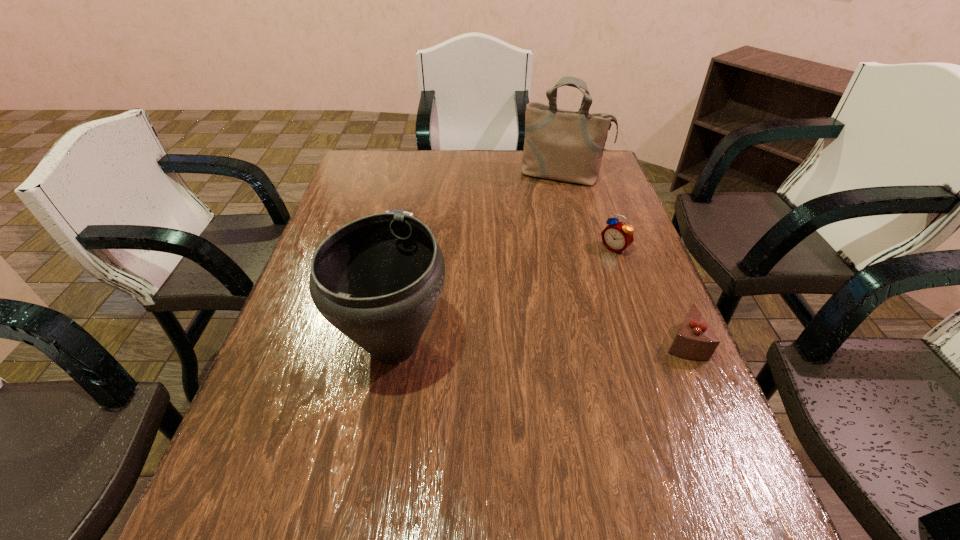
The height and width of the screenshot is (540, 960). What are the coordinates of `vacant space on the desktop that is between the urn and the chocolate cake and is positioned on the front-facing side of the goggles` in the screenshot? It's located at (545, 343).

This screenshot has width=960, height=540. I want to click on free spot on the desktop that is between the second tallest object and the chocolate cake and is positioned on the front-facing side of the alarm clock, so click(x=497, y=345).

The image size is (960, 540). What are the coordinates of `free spot on the desktop that is between the second tallest object and the chocolate cake and is positioned on the front-facing side of the tallest object` in the screenshot? It's located at (516, 344).